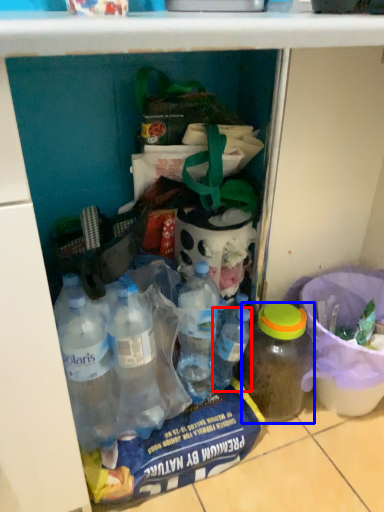
Question: Which object is further to the camera taking this photo, bottle (highlighted by a red box) or bottle (highlighted by a blue box)?

Choices:
 (A) bottle
 (B) bottle

Answer: (A)